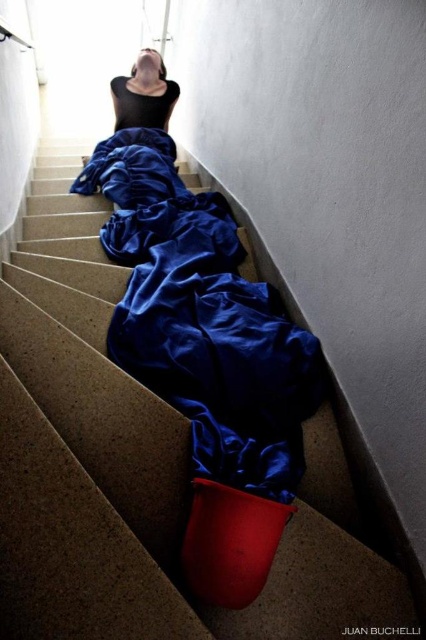
You are an interior designer assessing the layout of this staircase. The black matte fabric at center is positioned at coordinates 0.148, 0.338. If you were to place a decorative sculpture here, would it obstruct the view of the red bucket at the bottom of the stairs?

The black matte fabric at center is located at point (x=143, y=93). Since the fabric is placed centrally on the staircase, it might obstruct the view of the red bucket at the bottom depending on the sculpture size and placement. However, the exact obstruction cannot be determined without knowing the sculpture dimensions and exact positioning relative to the fabric.